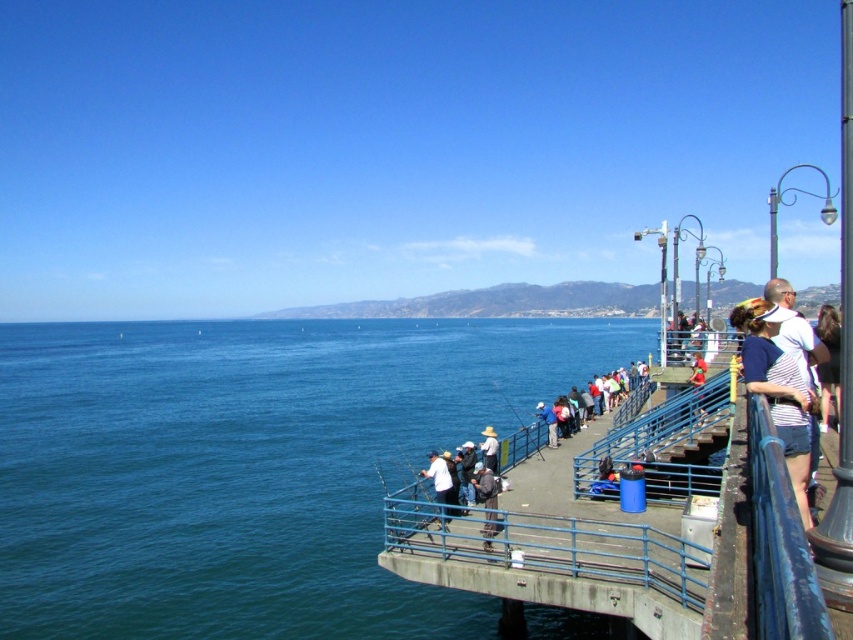
Looking at this image, does blue water at center have a larger size compared to white cotton hat at center?

Yes.

Does point (76, 392) come farther from viewer compared to point (494, 468)?

Yes.

What do you see at coordinates (251, 467) in the screenshot? The image size is (853, 640). I see `blue water at center` at bounding box center [251, 467].

I want to click on blue water at center, so click(251, 467).

Does white striped shirt at right appear on the right side of dark brown hair at right?

No, white striped shirt at right is not to the right of dark brown hair at right.

Is white striped shirt at right to the left of dark brown hair at right from the viewer's perspective?

Correct, you'll find white striped shirt at right to the left of dark brown hair at right.

The width and height of the screenshot is (853, 640). What do you see at coordinates (776, 390) in the screenshot?
I see `white striped shirt at right` at bounding box center [776, 390].

Locate an element on the screen. This screenshot has width=853, height=640. white striped shirt at right is located at coordinates 776,390.

Who is shorter, white striped shirt at right or white cotton hat at center?

white striped shirt at right is shorter.

Is point (798, 380) closer to viewer compared to point (496, 460)?

Yes, it is in front of point (496, 460).

Where is `white striped shirt at right`? The height and width of the screenshot is (640, 853). white striped shirt at right is located at coordinates (776, 390).